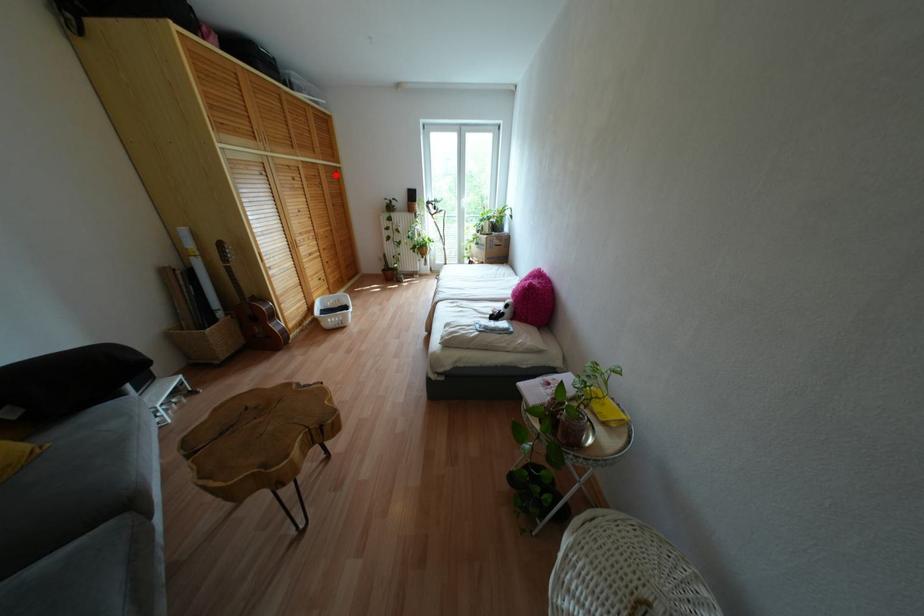
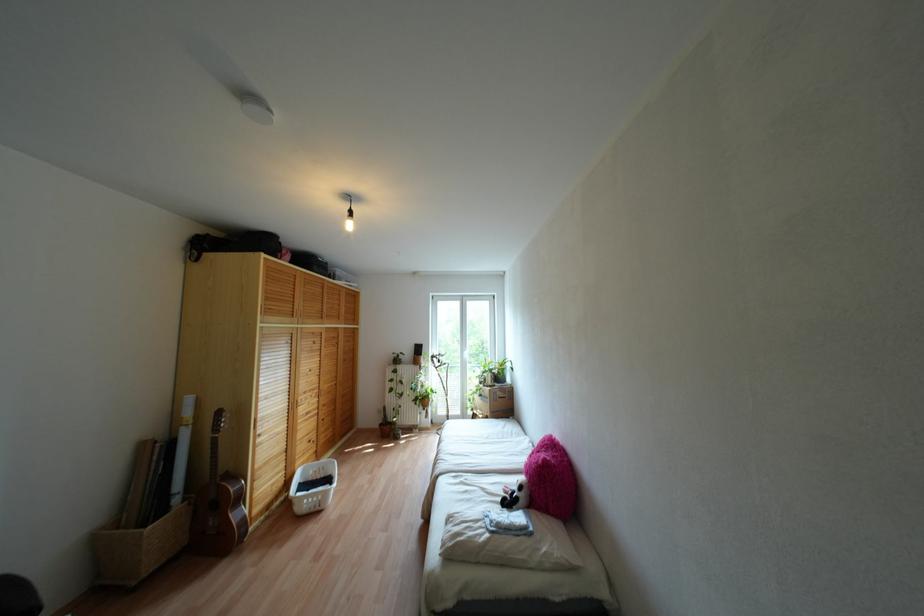
Question: I am providing you with two images of the same scene from different viewpoints. A red point is marked on the first image. Can you still see the location of the red point in image 2?

Choices:
 (A) Yes
 (B) No

Answer: (A)